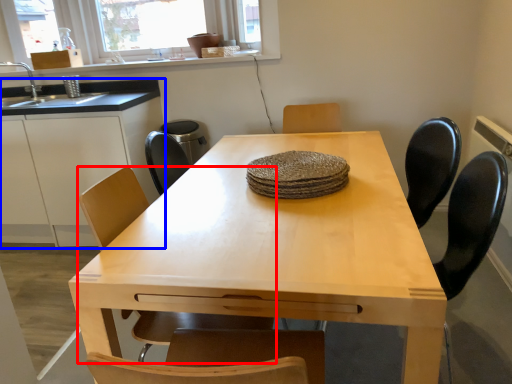
Question: Which point is closer to the camera, chair (highlighted by a red box) or cabinetry (highlighted by a blue box)?

Choices:
 (A) chair
 (B) cabinetry

Answer: (A)